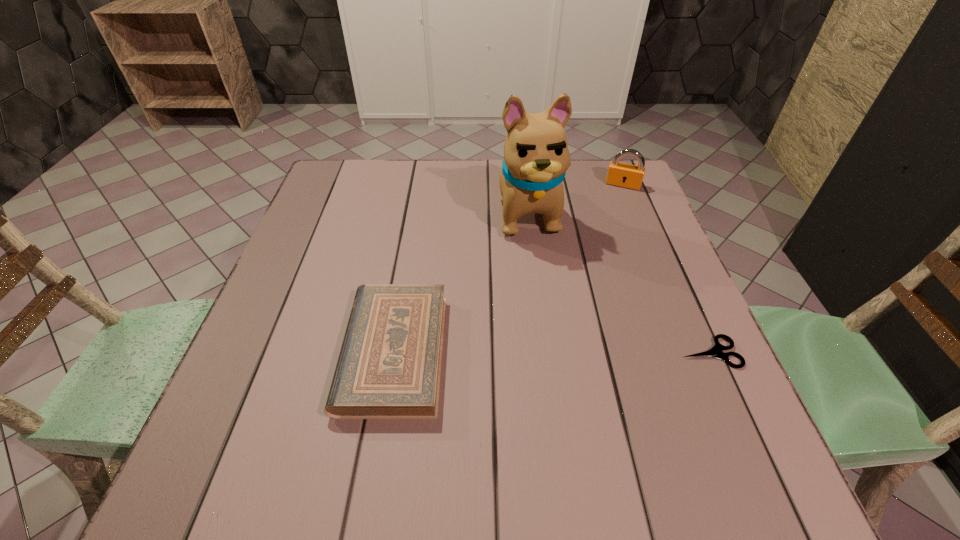
The width and height of the screenshot is (960, 540). Find the location of `Bible`. Bible is located at coordinates (389, 366).

You are a GUI agent. You are given a task and a screenshot of the screen. Output one action in this format:
    pyautogui.click(x=<x>, y=<y>)
    Task: Click on the second shortest object
    This screenshot has height=540, width=960.
    Given the screenshot: What is the action you would take?
    pyautogui.click(x=389, y=366)

Locate an element on the screen. This screenshot has height=540, width=960. shears is located at coordinates (716, 351).

Locate an element on the screen. Image resolution: width=960 pixels, height=540 pixels. the tallest object is located at coordinates (536, 156).

At what (x,y) coordinates should I click in order to perform the action: click on puppy. Please return your answer as a coordinate pair (x, y). Image resolution: width=960 pixels, height=540 pixels. Looking at the image, I should click on (536, 156).

You are a GUI agent. You are given a task and a screenshot of the screen. Output one action in this format:
    pyautogui.click(x=<x>, y=<y>)
    Task: Click on the padlock
    
    Given the screenshot: What is the action you would take?
    pyautogui.click(x=619, y=174)

This screenshot has height=540, width=960. In order to click on free space located on the spine side of the second shortest object in this screenshot , I will do `click(283, 352)`.

Identify the location of free space located 0.190m on the spine side of the second shortest object. Image resolution: width=960 pixels, height=540 pixels. (x=248, y=352).

You are a GUI agent. You are given a task and a screenshot of the screen. Output one action in this format:
    pyautogui.click(x=<x>, y=<y>)
    Task: Click on the free space located on the spine side of the second shortest object
    The image size is (960, 540).
    Given the screenshot: What is the action you would take?
    pyautogui.click(x=268, y=352)

Image resolution: width=960 pixels, height=540 pixels. In order to click on free space located 0.170m on the back of the shears in this screenshot , I will do `click(676, 277)`.